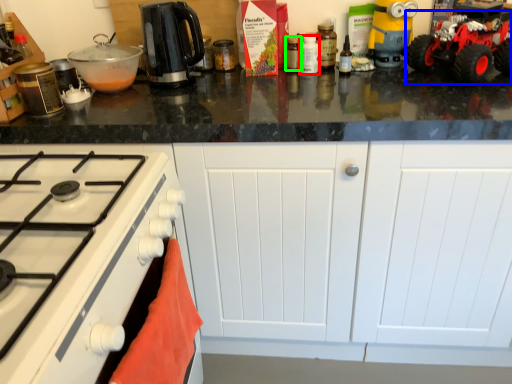
Question: Which object is positioned farthest from kitchen appliance (highlighted by a red box)? Select from toy car (highlighted by a blue box) and kitchen appliance (highlighted by a green box).

Choices:
 (A) toy car
 (B) kitchen appliance

Answer: (A)